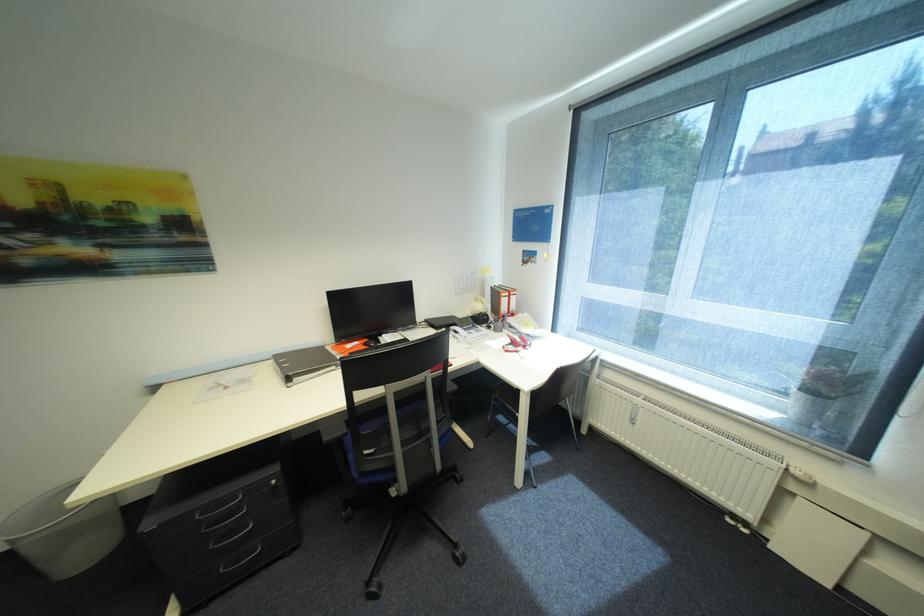
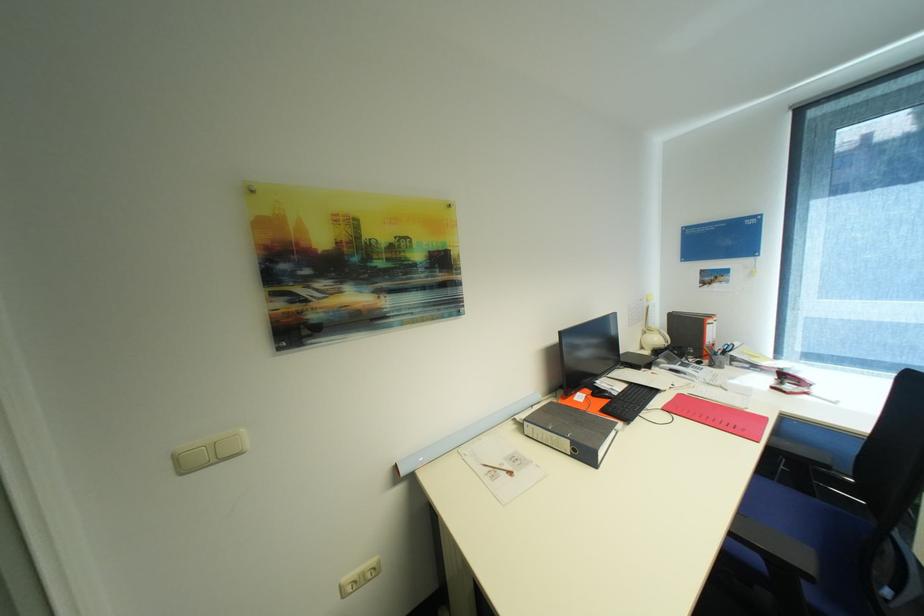
Where in the second image is the point corresponding to (x=396, y=342) from the first image?

(627, 391)